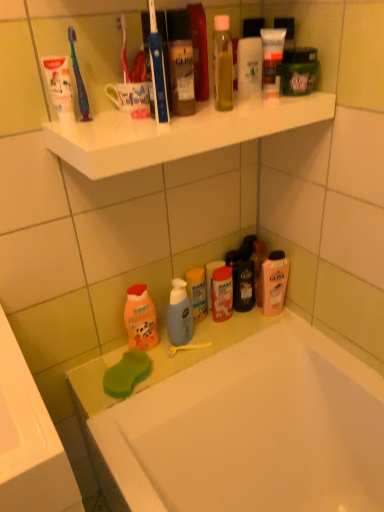
Identify the location of empty space that is ontop of white glossy shelf at upper center (from a real-world perspective). (160, 119).